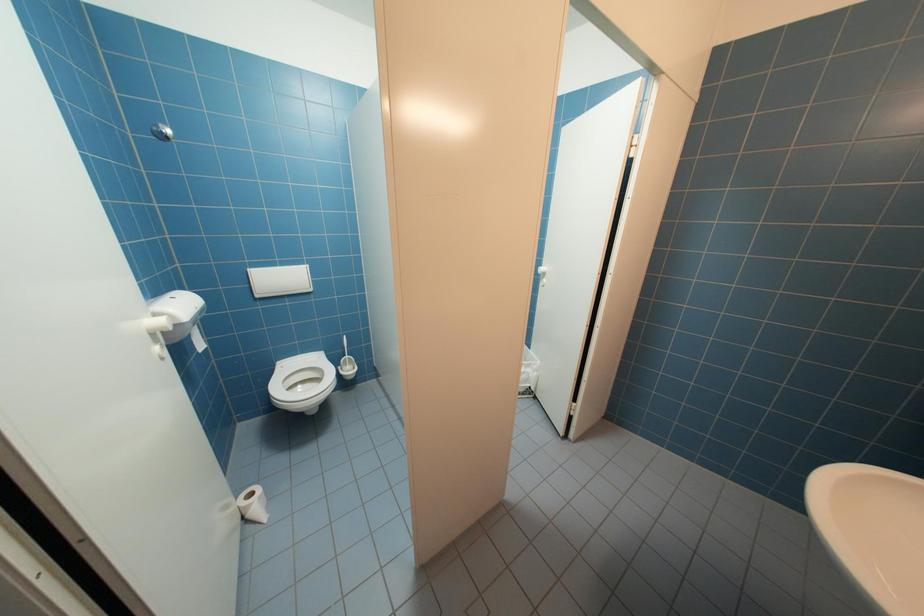
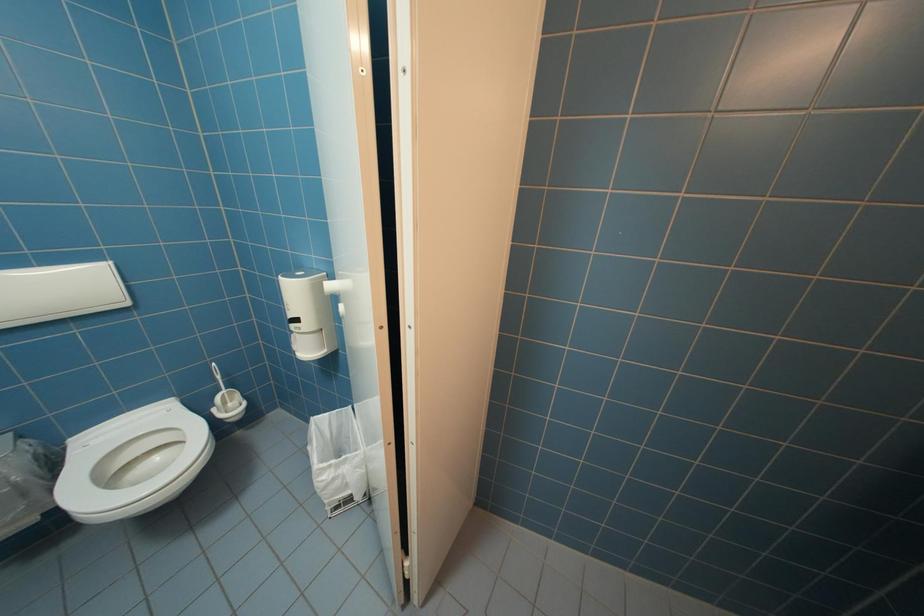
Which direction would the cameraman need to move to produce the second image?

The cameraman walked toward right, forward.